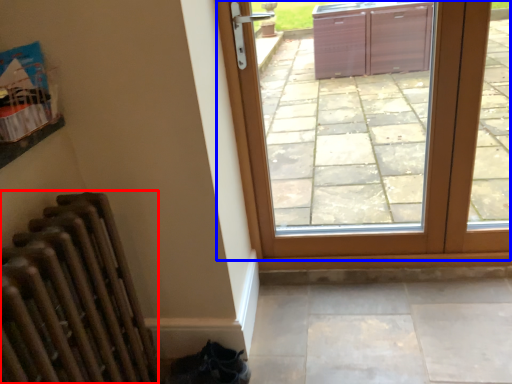
Question: Which point is further to the camera, radiator (highlighted by a red box) or door (highlighted by a blue box)?

Choices:
 (A) radiator
 (B) door

Answer: (B)